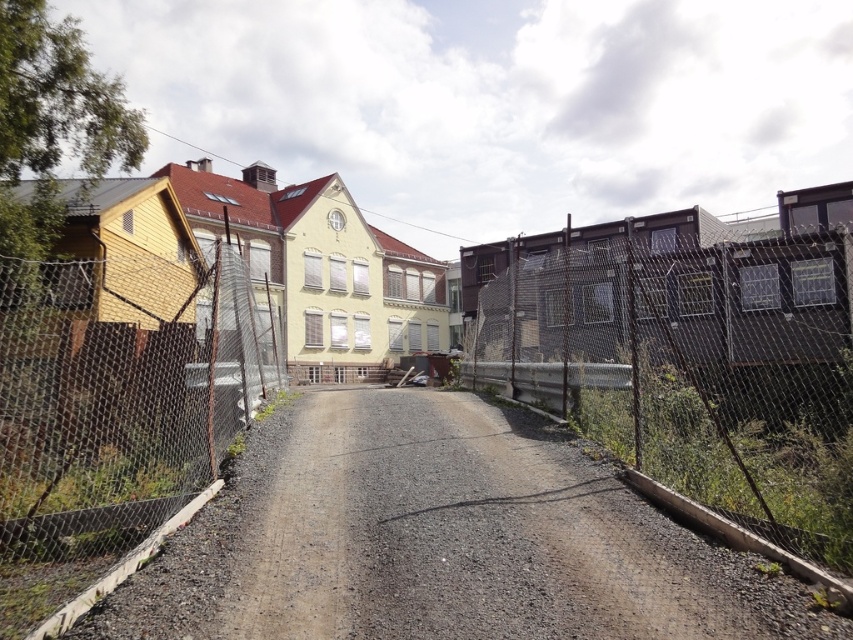
You are a delivery truck driver who needs to park your vehicle which is 25 feet long. You see the gray gravel road at center and the wire mesh fence at left. Is there enough space between them to park your truck without touching the fence?

The gray gravel road at center and wire mesh fence at left are 25.78 feet apart from each other. Since the truck is 25 feet long, there is enough space to park between them without touching the fence.